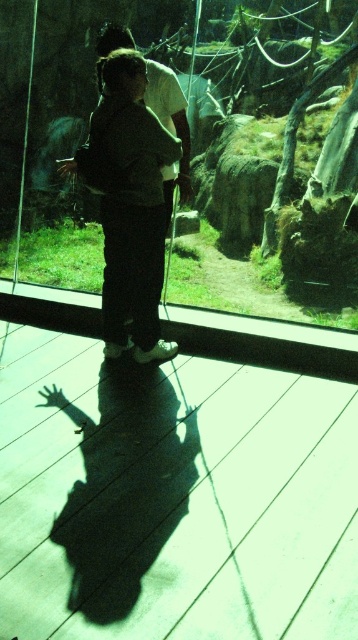
You are a zoo visitor trying to exit the exhibit through the transparent glass door at center. Your dark gray pants at center are 1.2 meters wide. Can you pass through the door without touching the sides?

The transparent glass door at center has a lesser width compared to dark gray pants at center, which are 1.2 meters wide. Since the door is narrower, you may need to adjust your stance to fit through without touching the sides.

You are standing in the zoo and want to take a photo of the animals through the transparent glass door at center. However, there is a shadow on the glass caused by the person in white shirt and darker pants. Where should you move to avoid the shadow? Please answer with coordinates in the format of point followed by direction. For example, point (x=191, y=148) move to the north.

The transparent glass door at center is located at point (x=191, y=148). To avoid the shadow cast by the person in white shirt and darker pants, you should move to the north of the point (x=191, y=148).

You are a zookeeper who needs to enter the enclosure to feed the animals. The transparent glass door at center is the only entrance. To open it, you must input the exact coordinates of its position. What are the coordinates?

The coordinates of the transparent glass door at center are at point (191,148).